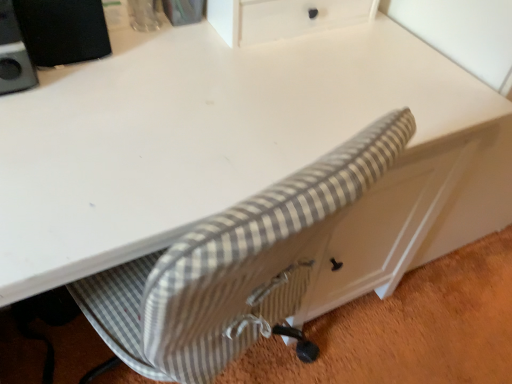
Question: Is gray striped fabric chair at lower center behind black matte speaker at upper left?

Choices:
 (A) yes
 (B) no

Answer: (A)

Question: Does gray striped fabric chair at lower center have a smaller size compared to black matte speaker at upper left?

Choices:
 (A) no
 (B) yes

Answer: (A)

Question: From the image's perspective, is gray striped fabric chair at lower center beneath black matte speaker at upper left?

Choices:
 (A) no
 (B) yes

Answer: (B)

Question: From the image's perspective, is gray striped fabric chair at lower center over black matte speaker at upper left?

Choices:
 (A) no
 (B) yes

Answer: (A)

Question: Is black matte speaker at upper left a part of gray striped fabric chair at lower center?

Choices:
 (A) no
 (B) yes

Answer: (A)

Question: Does gray striped fabric chair at lower center appear on the left side of black matte speaker at upper left?

Choices:
 (A) no
 (B) yes

Answer: (A)

Question: Is black matte speaker at upper left not close to gray striped fabric chair at lower center?

Choices:
 (A) yes
 (B) no

Answer: (B)

Question: Does black matte speaker at upper left lie in front of gray striped fabric chair at lower center?

Choices:
 (A) no
 (B) yes

Answer: (B)

Question: From a real-world perspective, is black matte speaker at upper left physically above gray striped fabric chair at lower center?

Choices:
 (A) no
 (B) yes

Answer: (B)

Question: Is gray striped fabric chair at lower center at the back of black matte speaker at upper left?

Choices:
 (A) yes
 (B) no

Answer: (B)

Question: Considering the relative positions of black matte speaker at upper left and gray striped fabric chair at lower center in the image provided, is black matte speaker at upper left to the left of gray striped fabric chair at lower center from the viewer's perspective?

Choices:
 (A) no
 (B) yes

Answer: (B)

Question: Considering the relative sizes of black matte speaker at upper left and gray striped fabric chair at lower center in the image provided, is black matte speaker at upper left bigger than gray striped fabric chair at lower center?

Choices:
 (A) no
 (B) yes

Answer: (A)

Question: Looking at their shapes, would you say black matte speaker at upper left is wider or thinner than gray striped fabric chair at lower center?

Choices:
 (A) thin
 (B) wide

Answer: (A)